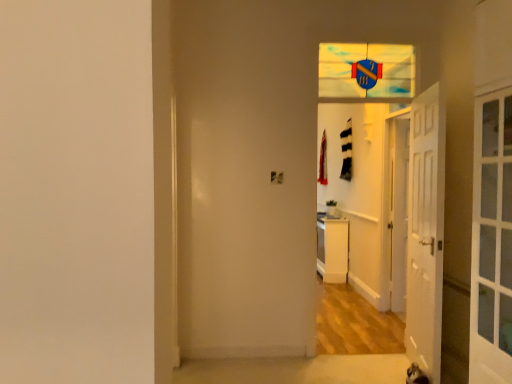
Identify the location of white glossy dresser at center. 332,249.

You are a GUI agent. You are given a task and a screenshot of the screen. Output one action in this format:
    pyautogui.click(x=<x>, y=<y>)
    Task: Click on the white glossy door at center, the 1th door in the back-to-front sequence
    
    Given the screenshot: What is the action you would take?
    pyautogui.click(x=398, y=209)

Considering the sizes of white wooden door at right, placed as the second door when sorted from back to front, and white glossy dresser at center in the image, is white wooden door at right, placed as the second door when sorted from back to front, taller or shorter than white glossy dresser at center?

white wooden door at right, placed as the second door when sorted from back to front, is taller than white glossy dresser at center.

Which of these two, white wooden door at right, acting as the 1th door starting from the left, or white glossy dresser at center, is smaller?

white wooden door at right, acting as the 1th door starting from the left.

Does white wooden door at right, which is the first door from front to back, have a greater width compared to white glossy dresser at center?

Incorrect, the width of white wooden door at right, which is the first door from front to back, does not surpass that of white glossy dresser at center.

From the image's perspective, is white glossy dresser at center under stained glass shield at upper center?

Yes, from the image's perspective, white glossy dresser at center is below stained glass shield at upper center.

Is the surface of white glossy dresser at center in direct contact with stained glass shield at upper center?

No, white glossy dresser at center is not touching stained glass shield at upper center.

From the picture: Does white glossy dresser at center have a lesser width compared to stained glass shield at upper center?

No, white glossy dresser at center is not thinner than stained glass shield at upper center.

Choose the correct answer: Is white glossy dresser at center inside stained glass shield at upper center or outside it?

white glossy dresser at center exists outside the volume of stained glass shield at upper center.

Is white wooden door at right, the second door viewed from the right, surrounded by stained glass shield at upper center?

Definitely not — white wooden door at right, the second door viewed from the right, is not inside stained glass shield at upper center.

Between stained glass shield at upper center and white wooden door at right, placed as the second door when sorted from back to front, which one has less height?

With less height is stained glass shield at upper center.

Are stained glass shield at upper center and white glossy dresser at center far apart?

Yes.

Looking at this image, from a real-world perspective, is stained glass shield at upper center below white glossy dresser at center?

No, from a real-world perspective, stained glass shield at upper center is not below white glossy dresser at center.

Is point (372, 83) positioned after point (325, 280)?

No.

Consider the image. From the image's perspective, would you say stained glass shield at upper center is shown under white glossy dresser at center?

Actually, stained glass shield at upper center appears above white glossy dresser at center in the image.

Looking at this image, from a real-world perspective, between white wooden door at right, the second door viewed from the right, and white glossy door at center, which is counted as the first door, starting from the right, who is vertically lower?

white glossy door at center, which is counted as the first door, starting from the right.

Considering the relative sizes of white wooden door at right, which is the first door from front to back, and white glossy door at center, which is counted as the first door, starting from the right, in the image provided, is white wooden door at right, which is the first door from front to back, wider than white glossy door at center, which is counted as the first door, starting from the right,?

Correct, the width of white wooden door at right, which is the first door from front to back, exceeds that of white glossy door at center, which is counted as the first door, starting from the right.

Considering the relative positions of white wooden door at right, placed as the second door when sorted from back to front, and white glossy door at center, which is counted as the first door, starting from the right, in the image provided, is white wooden door at right, placed as the second door when sorted from back to front, in front of white glossy door at center, which is counted as the first door, starting from the right,?

Yes, it is in front of white glossy door at center, which is counted as the first door, starting from the right.

Is white wooden door at right, the second door viewed from the right, completely or partially outside of white glossy door at center, which is counted as the first door, starting from the right?

That's correct, white wooden door at right, the second door viewed from the right, is outside of white glossy door at center, which is counted as the first door, starting from the right.

From a real-world perspective, between white glossy door at center, the 1th door in the back-to-front sequence, and stained glass shield at upper center, who is vertically higher?

In real-world perspective, stained glass shield at upper center is above.

From the image's perspective, which object appears higher, white glossy door at center, which is counted as the first door, starting from the right, or stained glass shield at upper center?

stained glass shield at upper center, from the image's perspective.

Is white glossy door at center, the 1th door in the back-to-front sequence, bigger or smaller than stained glass shield at upper center?

Considering their sizes, white glossy door at center, the 1th door in the back-to-front sequence, takes up less space than stained glass shield at upper center.

Between white glossy door at center, marked as the second door in a front-to-back arrangement, and stained glass shield at upper center, which one appears on the left side from the viewer's perspective?

Positioned to the left is stained glass shield at upper center.

Considering the relative sizes of white glossy door at center, marked as the second door in a left-to-right arrangement, and white glossy dresser at center in the image provided, is white glossy door at center, marked as the second door in a left-to-right arrangement, smaller than white glossy dresser at center?

Yes.

Is white glossy door at center, marked as the second door in a left-to-right arrangement, facing towards white glossy dresser at center?

No, white glossy door at center, marked as the second door in a left-to-right arrangement, does not turn towards white glossy dresser at center.

Can you confirm if white glossy door at center, marked as the second door in a left-to-right arrangement, is thinner than white glossy dresser at center?

Correct, the width of white glossy door at center, marked as the second door in a left-to-right arrangement, is less than that of white glossy dresser at center.

You are a GUI agent. You are given a task and a screenshot of the screen. Output one action in this format:
    pyautogui.click(x=<x>, y=<y>)
    Task: Click on the dresser on the left of white wooden door at right, acting as the 1th door starting from the left
    
    Given the screenshot: What is the action you would take?
    pyautogui.click(x=332, y=249)

Where is `dresser below the stained glass shield at upper center (from the image's perspective)`? This screenshot has height=384, width=512. dresser below the stained glass shield at upper center (from the image's perspective) is located at coordinates (332, 249).

In the scene shown: Estimate the real-world distances between objects in this image. Which object is further from white glossy dresser at center, white wooden door at right, acting as the 1th door starting from the left, or white glossy door at center, marked as the second door in a left-to-right arrangement?

Among the two, white wooden door at right, acting as the 1th door starting from the left, is located further to white glossy dresser at center.

When comparing their distances from white wooden door at right, which is the first door from front to back, does white glossy dresser at center or stained glass shield at upper center seem closer?

stained glass shield at upper center is positioned closer to the anchor white wooden door at right, which is the first door from front to back.

Looking at the image, which one is located closer to white glossy door at center, marked as the second door in a front-to-back arrangement, white wooden door at right, placed as the second door when sorted from back to front, or stained glass shield at upper center?

Among the two, white wooden door at right, placed as the second door when sorted from back to front, is located nearer to white glossy door at center, marked as the second door in a front-to-back arrangement.

From the image, which object appears to be nearer to white glossy door at center, the 1th door in the back-to-front sequence, stained glass shield at upper center or white glossy dresser at center?

stained glass shield at upper center.

Looking at the image, which one is located further to stained glass shield at upper center, white glossy dresser at center or white wooden door at right, placed as the second door when sorted from back to front?

white glossy dresser at center.

Estimate the real-world distances between objects in this image. Which object is closer to stained glass shield at upper center, white glossy door at center, the 1th door in the back-to-front sequence, or white wooden door at right, the second door viewed from the right?

Among the two, white glossy door at center, the 1th door in the back-to-front sequence, is located nearer to stained glass shield at upper center.

When comparing their distances from white glossy dresser at center, does stained glass shield at upper center or white wooden door at right, placed as the second door when sorted from back to front, seem further?

stained glass shield at upper center is further to white glossy dresser at center.

Looking at the image, which one is located further to white glossy door at center, marked as the second door in a front-to-back arrangement, stained glass shield at upper center or white wooden door at right, acting as the 1th door starting from the left?

stained glass shield at upper center lies further to white glossy door at center, marked as the second door in a front-to-back arrangement, than the other object.

Where is `door between white wooden door at right, the second door viewed from the right, and white glossy dresser at center from front to back`? This screenshot has height=384, width=512. door between white wooden door at right, the second door viewed from the right, and white glossy dresser at center from front to back is located at coordinates (398, 209).

Image resolution: width=512 pixels, height=384 pixels. I want to click on glass window between white wooden door at right, acting as the 1th door starting from the left, and white glossy door at center, the 1th door in the back-to-front sequence, in the front-back direction, so click(366, 72).

The image size is (512, 384). What are the coordinates of `glass window between white wooden door at right, which is the first door from front to back, and white glossy dresser at center in the front-back direction` in the screenshot? It's located at (366, 72).

Locate an element on the screen. The image size is (512, 384). door between stained glass shield at upper center and white glossy dresser at center from front to back is located at coordinates (398, 209).